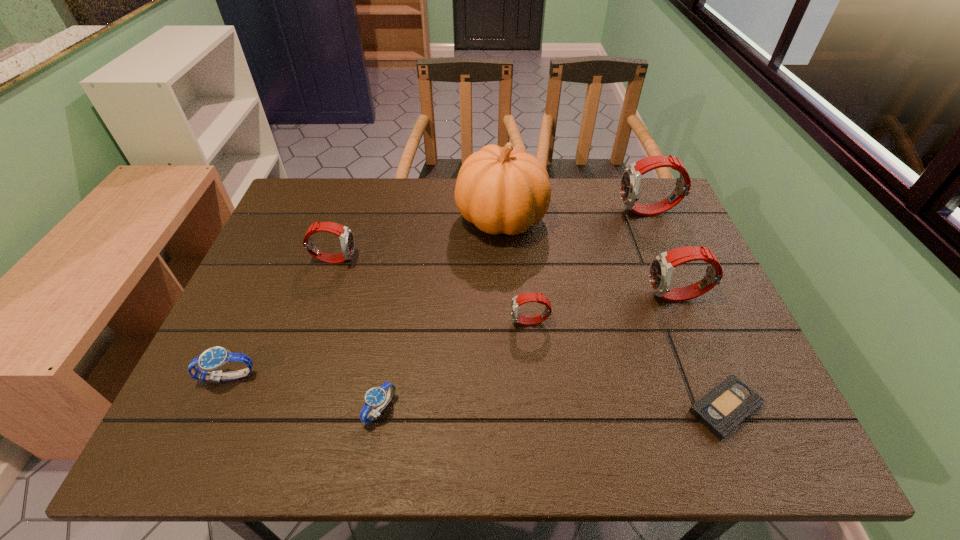
This screenshot has height=540, width=960. Find the location of `vacant space situated on the face of the second tallest watch`. vacant space situated on the face of the second tallest watch is located at coordinates (536, 296).

I want to click on vacant space positioned on the face of the second tallest watch, so click(x=612, y=296).

At what (x,y) coordinates should I click in order to perform the action: click on vacant space situated on the face of the second object from left to right. Please return your answer as a coordinate pair (x, y). This screenshot has height=540, width=960. Looking at the image, I should click on (444, 259).

Where is `free point located on the face of the fourth nearest object`? This screenshot has height=540, width=960. free point located on the face of the fourth nearest object is located at coordinates (368, 322).

Where is `free space located on the face of the fourth nearest object`? Image resolution: width=960 pixels, height=540 pixels. free space located on the face of the fourth nearest object is located at coordinates (415, 322).

Where is `free point located 0.240m on the face of the fourth nearest object`? This screenshot has width=960, height=540. free point located 0.240m on the face of the fourth nearest object is located at coordinates (410, 322).

The image size is (960, 540). In order to click on vacant space situated on the right of the sixth tallest object in this screenshot , I will do `click(331, 377)`.

Image resolution: width=960 pixels, height=540 pixels. What are the coordinates of `free location located on the right of the third watch from left to right` in the screenshot? It's located at (518, 410).

Find the location of a particular element. free space located on the back of the videotape is located at coordinates (670, 275).

The width and height of the screenshot is (960, 540). I want to click on pumpkin that is at the far edge, so click(501, 190).